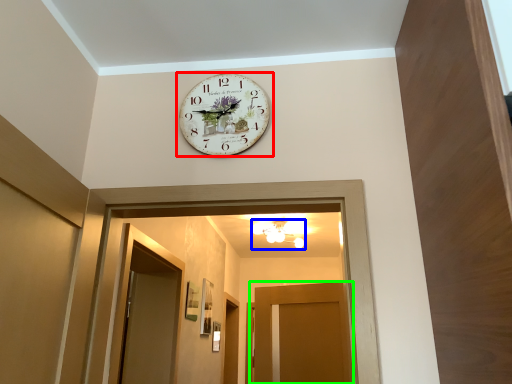
Question: Which object is positioned closest to wall clock (highlighted by a red box)? Select from light fixture (highlighted by a blue box) and door (highlighted by a green box).

Choices:
 (A) light fixture
 (B) door

Answer: (B)